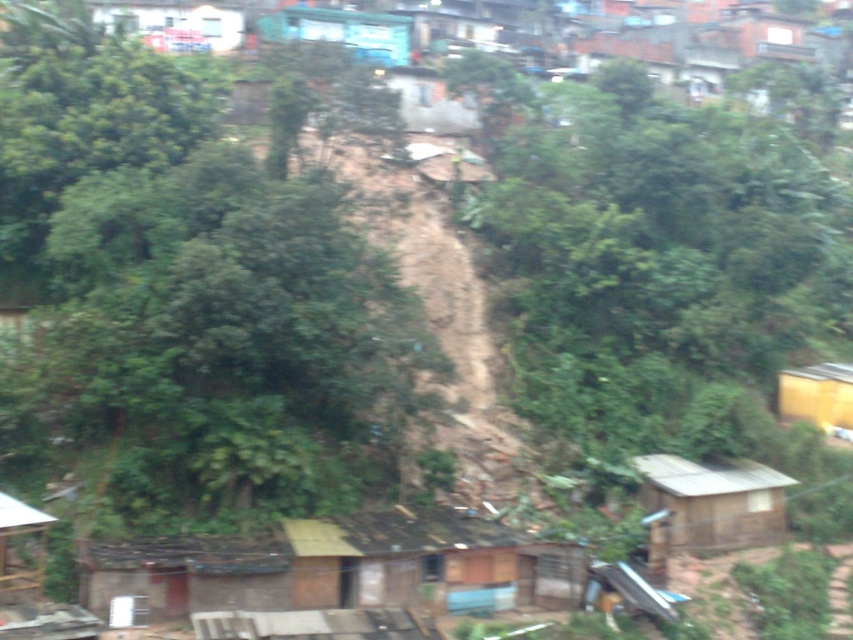
You are a delivery drone flying over the hilly area described. You need to drop a package at the yellow matte hut at right. However, there is a green leafy tree at center in your path. Can you safely navigate around the tree to deliver the package?

The green leafy tree at center is positioned over the yellow matte hut at right, so the drone can safely navigate around the tree to deliver the package since the tree is above the hut and not blocking the path directly.

You are standing at the point with coordinates point (x=357, y=16) and want to walk to the point with coordinates point (x=90, y=272). According to the image, which direction should you move relative to your current position?

You should move forward because point (x=90, y=272) is in front of point (x=357, y=16).

You are a delivery person carrying a package that requires a 30 meter delivery radius. You are currently at the wooden hut at lower left and need to deliver the package to the yellow matte hut at right. Can you complete the delivery within the required radius?

The distance between the wooden hut at lower left and the yellow matte hut at right is 34.21 meters, which exceeds the 30 meter delivery radius. Therefore, you cannot complete the delivery within the required radius.